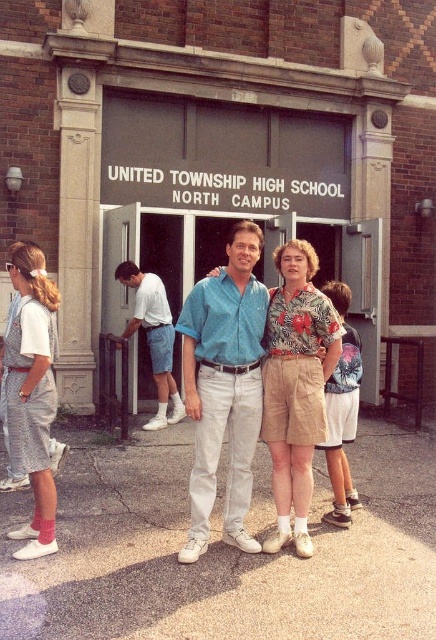
Measure the distance between point (289, 499) and camera.

A distance of 15.65 feet exists between point (289, 499) and camera.

In order to click on blue cotton shirt at center in this screenshot , I will do 255,385.

I want to click on blue cotton shirt at center, so click(x=255, y=385).

Between floral print shirt at center and plaid denim overall at left, which one is positioned lower?

Positioned lower is floral print shirt at center.

This screenshot has height=640, width=436. What do you see at coordinates (296, 387) in the screenshot?
I see `floral print shirt at center` at bounding box center [296, 387].

Image resolution: width=436 pixels, height=640 pixels. I want to click on floral print shirt at center, so click(x=296, y=387).

Consider the image. Who is shorter, blue cotton shirt at center or floral print shirt at center?

Standing shorter between the two is floral print shirt at center.

Does blue cotton shirt at center have a greater width compared to floral print shirt at center?

A: Yes.

Is point (247, 540) positioned in front of point (303, 394)?

No, (247, 540) is further to viewer.

Image resolution: width=436 pixels, height=640 pixels. I want to click on blue cotton shirt at center, so click(x=255, y=385).